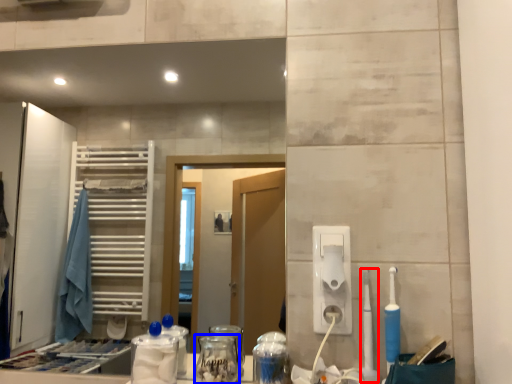
Question: Which of the following is the closest to the observer, toothbrush (highlighted by a red box) or glass jar (highlighted by a blue box)?

Choices:
 (A) toothbrush
 (B) glass jar

Answer: (B)